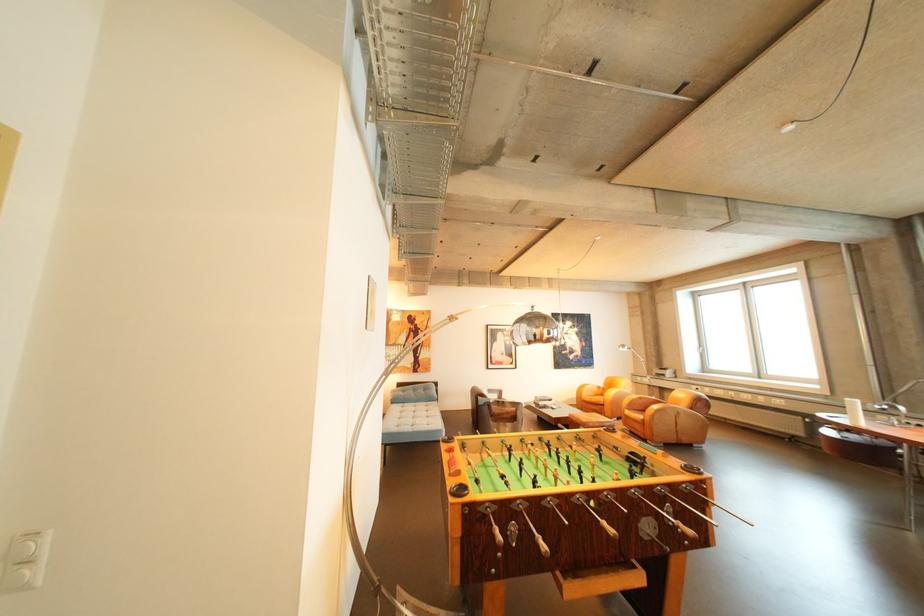
Locate an element on the screen. orange chair surface is located at coordinates (596, 398).